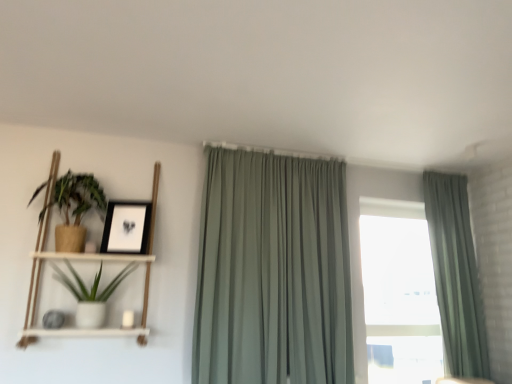
Question: Is sage green fabric curtain at center, acting as the first curtain starting from the left, at the right side of matte black picture frame at upper left?

Choices:
 (A) no
 (B) yes

Answer: (B)

Question: Is sage green fabric curtain at center, acting as the second curtain starting from the right, further to the viewer compared to matte black picture frame at upper left?

Choices:
 (A) no
 (B) yes

Answer: (A)

Question: Is matte black picture frame at upper left inside sage green fabric curtain at center, acting as the first curtain starting from the left?

Choices:
 (A) yes
 (B) no

Answer: (B)

Question: Considering the relative sizes of sage green fabric curtain at center, acting as the first curtain starting from the left, and matte black picture frame at upper left in the image provided, is sage green fabric curtain at center, acting as the first curtain starting from the left, shorter than matte black picture frame at upper left?

Choices:
 (A) no
 (B) yes

Answer: (A)

Question: Does sage green fabric curtain at center, acting as the first curtain starting from the left, turn towards matte black picture frame at upper left?

Choices:
 (A) yes
 (B) no

Answer: (B)

Question: Is sage green fabric curtain at center, acting as the first curtain starting from the left, far from matte black picture frame at upper left?

Choices:
 (A) yes
 (B) no

Answer: (B)

Question: Would you say white wood shelf at left contains matte brown pot at left, positioned as the first houseplant in top-to-bottom order?

Choices:
 (A) no
 (B) yes

Answer: (B)

Question: Does white wood shelf at left come in front of matte brown pot at left, positioned as the first houseplant in top-to-bottom order?

Choices:
 (A) no
 (B) yes

Answer: (B)

Question: From a real-world perspective, is white wood shelf at left on matte brown pot at left, the 2th houseplant from the bottom?

Choices:
 (A) yes
 (B) no

Answer: (B)

Question: From the image's perspective, does white wood shelf at left appear lower than matte brown pot at left, positioned as the first houseplant in top-to-bottom order?

Choices:
 (A) yes
 (B) no

Answer: (A)

Question: Is white wood shelf at left at the left side of matte brown pot at left, the 2th houseplant from the bottom?

Choices:
 (A) no
 (B) yes

Answer: (A)

Question: Is white wood shelf at left to the right of matte brown pot at left, positioned as the first houseplant in top-to-bottom order, from the viewer's perspective?

Choices:
 (A) no
 (B) yes

Answer: (B)

Question: Is matte brown pot at left, the 2th houseplant from the bottom, outside white wood shelf at left?

Choices:
 (A) yes
 (B) no

Answer: (B)